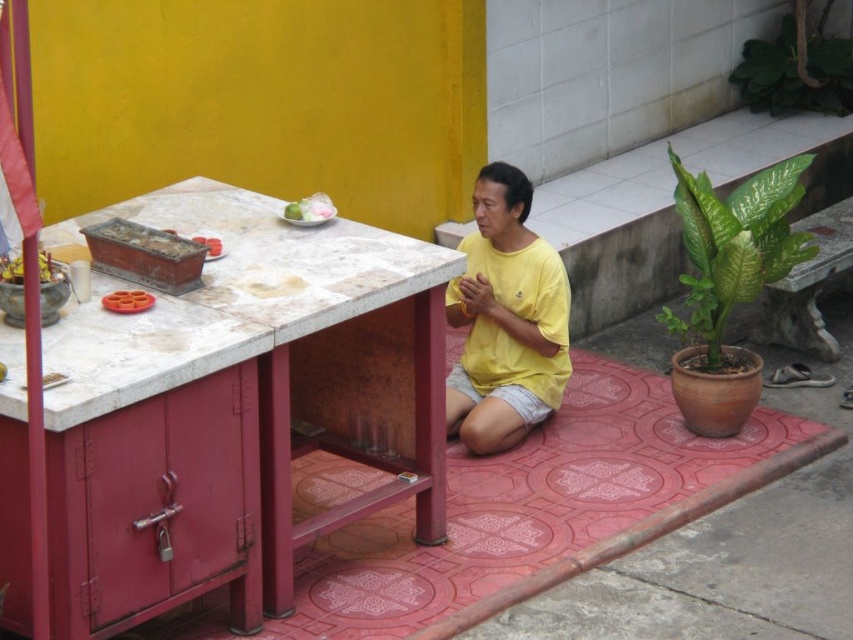
Can you confirm if marble top table at center is shorter than green leafy plant at upper right?

No.

Does marble top table at center appear under green leafy plant at upper right?

Yes, marble top table at center is below green leafy plant at upper right.

Between point (181, 484) and point (837, 88), which one is positioned behind?

The point (837, 88) is more distant.

The width and height of the screenshot is (853, 640). What are the coordinates of `marble top table at center` in the screenshot? It's located at (241, 368).

Who is positioned more to the right, green glossy leafy plant at right or white glossy plate at center?

Positioned to the right is green glossy leafy plant at right.

Does point (747, 218) come behind point (289, 208)?

That is True.

Locate an element on the screen. This screenshot has width=853, height=640. green glossy leafy plant at right is located at coordinates (734, 244).

Locate an element on the screen. Image resolution: width=853 pixels, height=640 pixels. marble top table at center is located at coordinates (241, 368).

Between point (165, 596) and point (300, 211), which one is positioned behind?

The point (300, 211) is more distant.

Where is `marble top table at center`? marble top table at center is located at coordinates (241, 368).